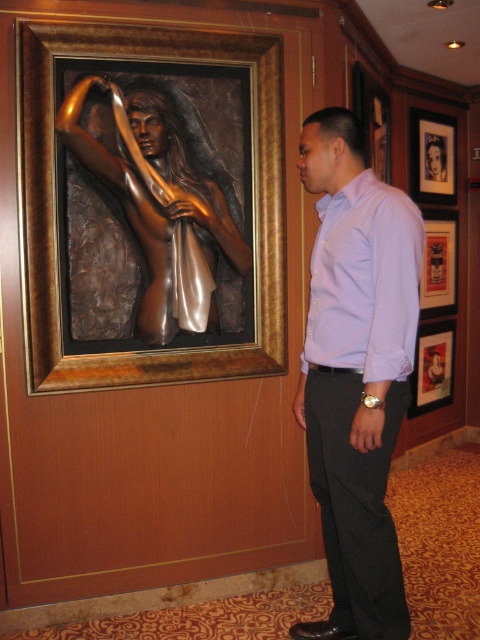
Can you confirm if purple cotton shirt at center is positioned to the right of matte black picture frame at upper right?

No, purple cotton shirt at center is not to the right of matte black picture frame at upper right.

Which is above, purple cotton shirt at center or matte black picture frame at upper right?

Positioned higher is matte black picture frame at upper right.

Find the location of `purple cotton shirt at center`. purple cotton shirt at center is located at coordinates (356, 372).

Does point (352, 316) come behind point (433, 189)?

No.

Which is above, light purple cotton shirt at right or matte black picture frame at upper right?

Positioned higher is matte black picture frame at upper right.

The height and width of the screenshot is (640, 480). Describe the element at coordinates (364, 280) in the screenshot. I see `light purple cotton shirt at right` at that location.

Locate an element on the screen. light purple cotton shirt at right is located at coordinates (364, 280).

Does point (262, 230) come closer to viewer compared to point (370, 364)?

No.

Is bronzemetallicsculpture at left behind light purple cotton shirt at right?

Yes.

Consider the image. Measure the distance between bronzemetallicsculpture at left and camera.

bronzemetallicsculpture at left is 2.23 meters from camera.

Where is `bronzemetallicsculpture at left`? bronzemetallicsculpture at left is located at coordinates (56, 202).